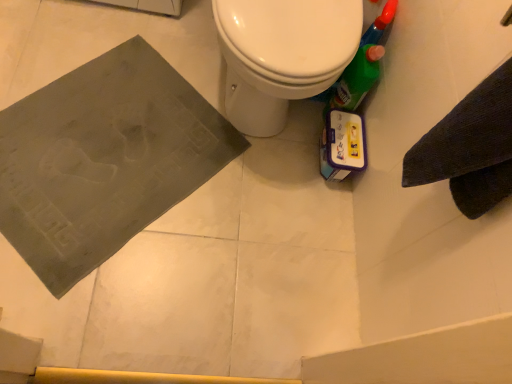
Identify the location of free region under dark gray rubber mat at lower left (from a real-world perspective). (133, 135).